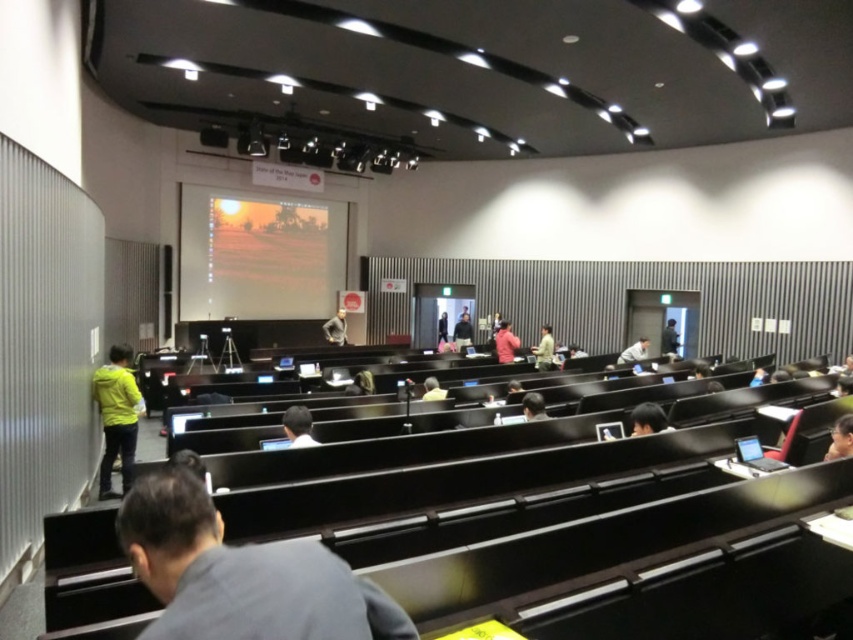
Does dark gray shirt at center have a greater height compared to light brown leather jacket at center?

Yes, dark gray shirt at center is taller than light brown leather jacket at center.

What do you see at coordinates (299, 426) in the screenshot? Image resolution: width=853 pixels, height=640 pixels. I see `dark gray shirt at center` at bounding box center [299, 426].

Consider the image. Who is more forward, (310, 442) or (432, 387)?

Point (310, 442) is more forward.

The width and height of the screenshot is (853, 640). Find the location of `dark gray shirt at center`. dark gray shirt at center is located at coordinates (299, 426).

Between point (184, 248) and point (117, 355), which one is positioned in front?

Point (117, 355) is in front.

Which is more to the left, matte orange screen at center or yellow fabric jacket at left?

From the viewer's perspective, matte orange screen at center appears more on the left side.

Is point (241, 204) behind point (115, 352)?

Yes, it is.

What are the coordinates of `matte orange screen at center` in the screenshot? It's located at (258, 257).

Between dark gray suit at lower center and matte orange screen at center, which one is positioned lower?

dark gray suit at lower center is lower down.

Does point (296, 577) come in front of point (254, 236)?

Yes, point (296, 577) is in front of point (254, 236).

Locate an element on the screen. The height and width of the screenshot is (640, 853). dark gray suit at lower center is located at coordinates (241, 573).